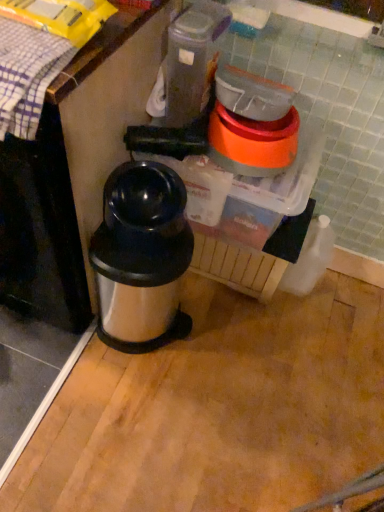
The width and height of the screenshot is (384, 512). Describe the element at coordinates (27, 75) in the screenshot. I see `plaid fabric at upper left` at that location.

Measure the distance between plaid fabric at upper left and camera.

plaid fabric at upper left and camera are 28.67 inches apart.

The image size is (384, 512). Describe the element at coordinates (237, 198) in the screenshot. I see `black plastic blender at center` at that location.

Measure the distance between point (x=162, y=328) and camera.

1.37 meters.

Image resolution: width=384 pixels, height=512 pixels. What are the coordinates of `plaid fabric at upper left` in the screenshot? It's located at pyautogui.click(x=27, y=75).

Can you tell me how much silver metallic thermos at center and black plastic blender at center differ in facing direction?

silver metallic thermos at center and black plastic blender at center are facing 0.000163 degrees away from each other.

Are silver metallic thermos at center and black plastic blender at center located far from each other?

No, silver metallic thermos at center is in close proximity to black plastic blender at center.

Would you say silver metallic thermos at center is inside or outside black plastic blender at center?

silver metallic thermos at center cannot be found inside black plastic blender at center.

Considering the positions of objects silver metallic thermos at center and black plastic blender at center in the image provided, who is behind, silver metallic thermos at center or black plastic blender at center?

black plastic blender at center is more distant.

Consider the image. From the image's perspective, is plaid fabric at upper left beneath silver metallic thermos at center?

No, from the image's perspective, plaid fabric at upper left is not below silver metallic thermos at center.

From the picture: Which is closer, (32, 120) or (134, 181)?

Positioned in front is point (32, 120).

Which is correct: plaid fabric at upper left is inside silver metallic thermos at center, or outside of it?

plaid fabric at upper left is spatially situated outside silver metallic thermos at center.

Which object is more forward, plaid fabric at upper left or silver metallic thermos at center?

plaid fabric at upper left is in front.

Is plaid fabric at upper left a part of silver metallic thermos at center?

Definitely not — plaid fabric at upper left is not inside silver metallic thermos at center.

Who is bigger, silver metallic thermos at center or plaid fabric at upper left?

Bigger between the two is silver metallic thermos at center.

Which is more to the right, silver metallic thermos at center or plaid fabric at upper left?

From the viewer's perspective, silver metallic thermos at center appears more on the right side.

Is silver metallic thermos at center far from plaid fabric at upper left?

They are positioned close to each other.

Would you say plaid fabric at upper left is part of black plastic blender at center's contents?

No, plaid fabric at upper left is not inside black plastic blender at center.

Is black plastic blender at center far from plaid fabric at upper left?

No, black plastic blender at center is not far away from plaid fabric at upper left.

Considering the positions of objects black plastic blender at center and plaid fabric at upper left in the image provided, who is more to the left, black plastic blender at center or plaid fabric at upper left?

plaid fabric at upper left is more to the left.

From the image's perspective, is black plastic blender at center positioned above or below plaid fabric at upper left?

black plastic blender at center is situated lower than plaid fabric at upper left in the image.

Is black plastic blender at center in contact with silver metallic thermos at center?

They are not placed beside each other.

From a real-world perspective, is black plastic blender at center located beneath silver metallic thermos at center?

No, from a real-world perspective, black plastic blender at center is not under silver metallic thermos at center.

Which object is positioned more to the left, black plastic blender at center or silver metallic thermos at center?

From the viewer's perspective, silver metallic thermos at center appears more on the left side.

Between black plastic blender at center and silver metallic thermos at center, which one is positioned in front?

silver metallic thermos at center.

From the picture: Between plaid fabric at upper left and black plastic blender at center, which one has smaller size?

plaid fabric at upper left is smaller.

Considering the sizes of objects plaid fabric at upper left and black plastic blender at center in the image provided, who is taller, plaid fabric at upper left or black plastic blender at center?

With more height is black plastic blender at center.

Is plaid fabric at upper left inside or outside of black plastic blender at center?

plaid fabric at upper left lies outside black plastic blender at center.

At what (x,y) coordinates should I click in order to perform the action: click on blender above the silver metallic thermos at center (from a real-world perspective). Please return your answer as a coordinate pair (x, y). Looking at the image, I should click on (237, 198).

The width and height of the screenshot is (384, 512). I want to click on waste container that appears below the plaid fabric at upper left (from the image's perspective), so click(x=141, y=258).

Considering their positions, is black plastic blender at center positioned closer to plaid fabric at upper left than silver metallic thermos at center?

silver metallic thermos at center is positioned closer to the anchor plaid fabric at upper left.

In the scene shown: Which object lies nearer to the anchor point silver metallic thermos at center, plaid fabric at upper left or black plastic blender at center?

Among the two, black plastic blender at center is located nearer to silver metallic thermos at center.

From the image, which object appears to be farther from silver metallic thermos at center, black plastic blender at center or plaid fabric at upper left?

plaid fabric at upper left lies further to silver metallic thermos at center than the other object.

From the image, which object appears to be nearer to plaid fabric at upper left, silver metallic thermos at center or black plastic blender at center?

silver metallic thermos at center.

Which object lies further to the anchor point black plastic blender at center, plaid fabric at upper left or silver metallic thermos at center?

plaid fabric at upper left is positioned further to the anchor black plastic blender at center.

Considering their positions, is silver metallic thermos at center positioned closer to black plastic blender at center than plaid fabric at upper left?

silver metallic thermos at center is positioned closer to the anchor black plastic blender at center.

The image size is (384, 512). I want to click on waste container between plaid fabric at upper left and black plastic blender at center in the horizontal direction, so click(141, 258).